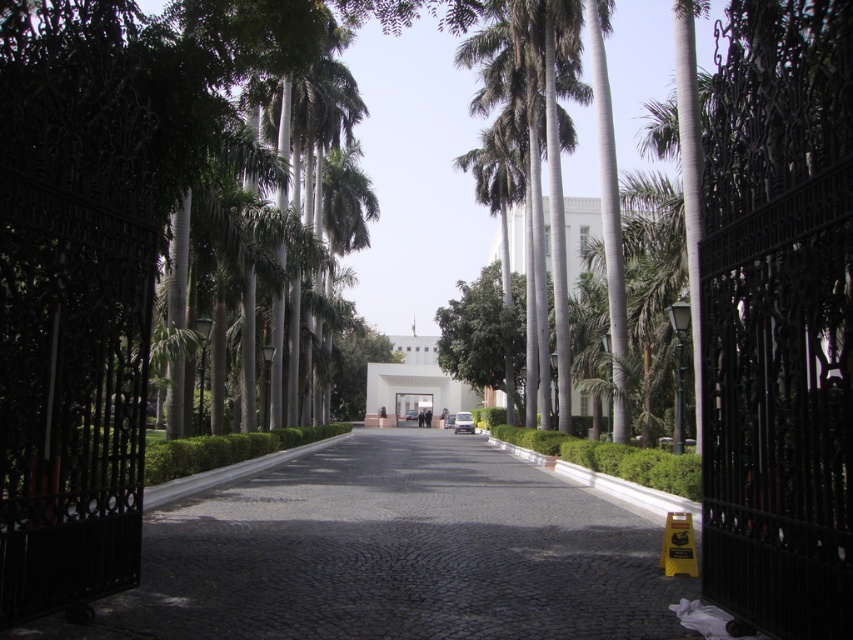
Who is shorter, cobblestone pavement at center or green leafy palm tree at center?

With less height is cobblestone pavement at center.

The height and width of the screenshot is (640, 853). Find the location of `cobblestone pavement at center`. cobblestone pavement at center is located at coordinates (393, 554).